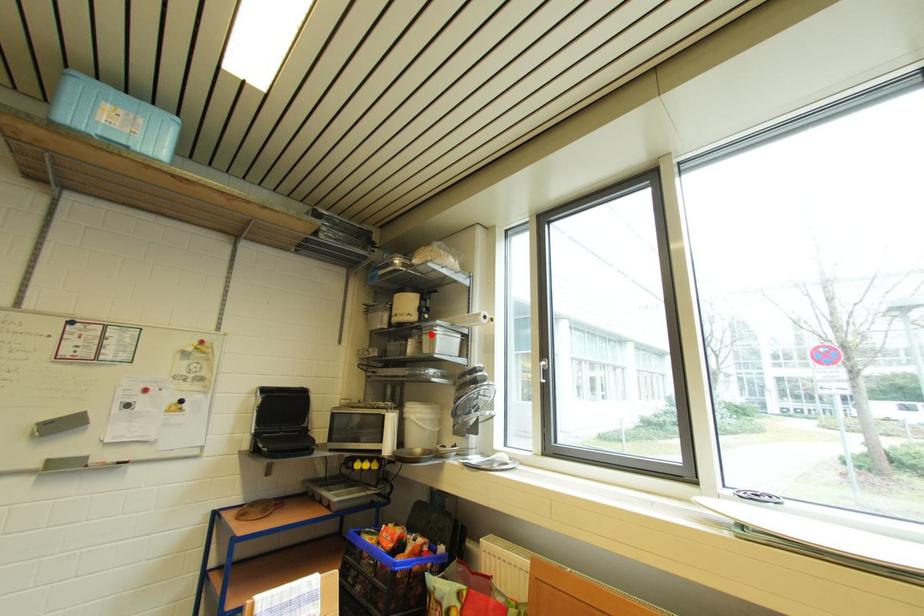
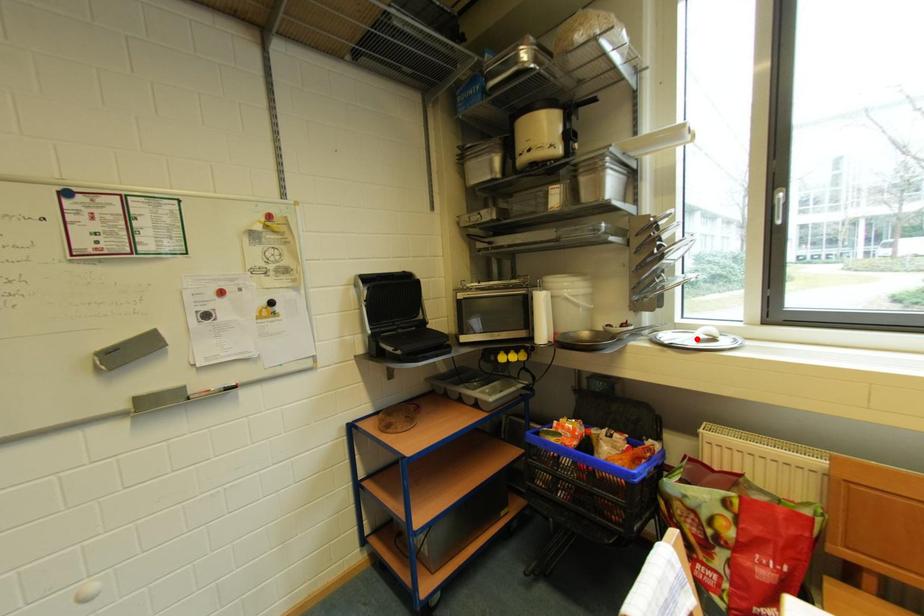
I am providing you with two images of the same scene from different viewpoints. A red point is marked on the first image and another point is marked on the second image. Does the point marked in image1 correspond to the same location as the one in image2?

No